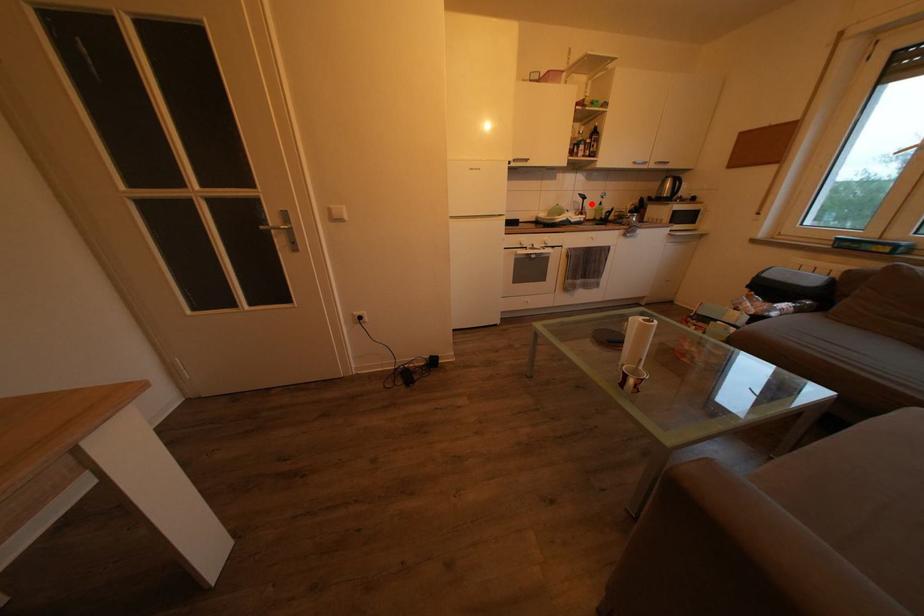
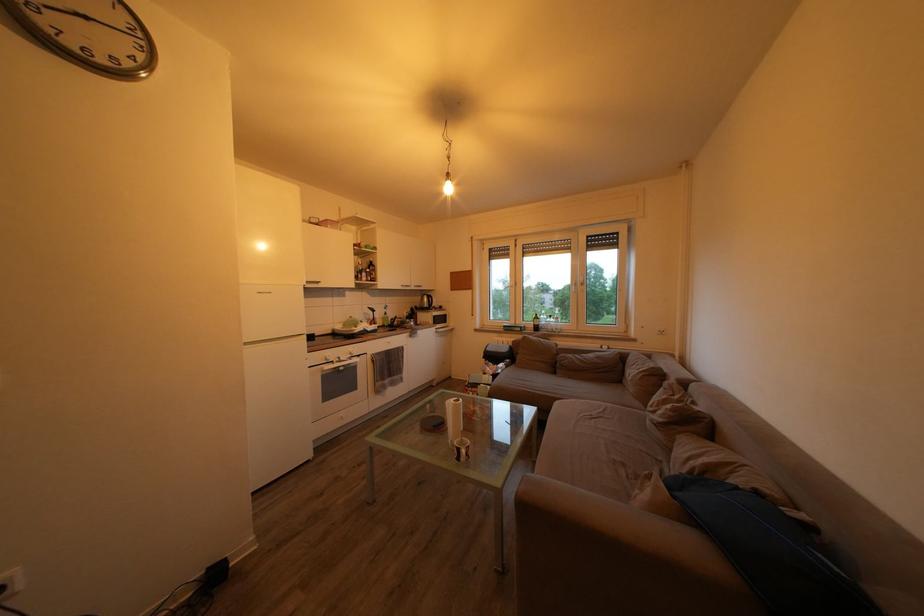
Question: I am providing you with two images of the same scene from different viewpoints. A red point is shown in image1. For the corresponding object point in image2, is it positioned nearer or farther from the camera?

Choices:
 (A) Nearer
 (B) Farther

Answer: (B)